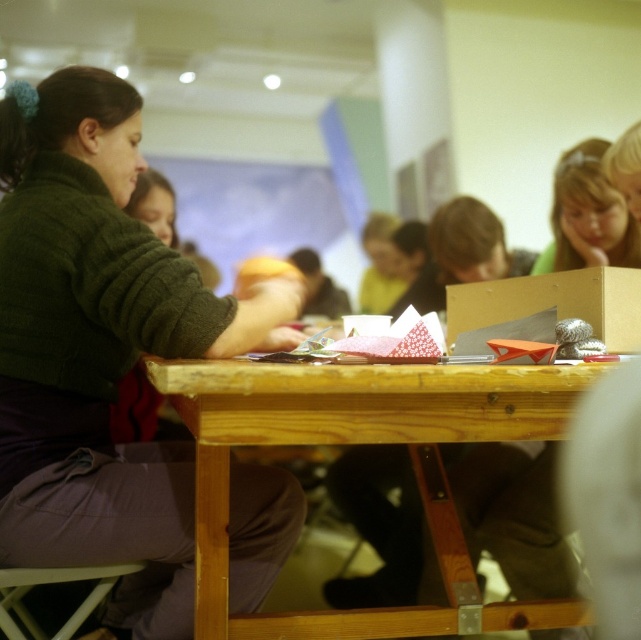
Question: Which point is farther to the camera?

Choices:
 (A) wooden table at center
 (B) wooden box at center
 (C) smooth skin face at upper right
 (D) green fuzzy sweater at left

Answer: (C)

Question: Considering the relative positions of green fuzzy sweater at left and wooden box at center in the image provided, where is green fuzzy sweater at left located with respect to wooden box at center?

Choices:
 (A) right
 (B) left

Answer: (B)

Question: Among these objects, which one is farthest from the camera?

Choices:
 (A) green fuzzy sweater at left
 (B) wooden stool at lower left
 (C) wooden table at center
 (D) wooden box at center

Answer: (B)

Question: Is green fuzzy sweater at left thinner than smooth skin face at upper right?

Choices:
 (A) yes
 (B) no

Answer: (B)

Question: Which object is closer to the camera taking this photo?

Choices:
 (A) smooth skin face at upper right
 (B) wooden box at center

Answer: (B)

Question: In this image, where is wooden box at center located relative to wooden stool at lower left?

Choices:
 (A) above
 (B) below

Answer: (A)